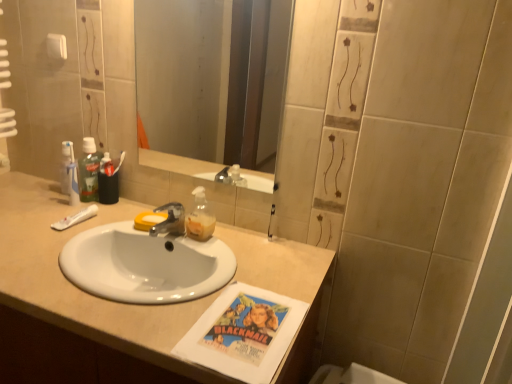
What do you see at coordinates (200, 217) in the screenshot? The width and height of the screenshot is (512, 384). I see `translucent plastic soap dispenser at center` at bounding box center [200, 217].

Locate an element on the screen. The height and width of the screenshot is (384, 512). white glossy sink at center is located at coordinates (79, 300).

Describe the element at coordinates (212, 77) in the screenshot. I see `smooth glass mirror at center` at that location.

This screenshot has width=512, height=384. Describe the element at coordinates (89, 171) in the screenshot. I see `green translucent mouthwash at upper left` at that location.

In order to click on metallic silver faucet at center in this screenshot , I will do coord(170,220).

What are the coordinates of `translucent plastic soap dispenser at center` in the screenshot? It's located at (200, 217).

Based on their positions, is translucent plastic soap dispenser at center located to the left or right of white matte toothpaste at left?

Based on their positions, translucent plastic soap dispenser at center is located to the right of white matte toothpaste at left.

Which object is more forward, translucent plastic soap dispenser at center or white matte toothpaste at left?

translucent plastic soap dispenser at center is more forward.

From a real-world perspective, is translucent plastic soap dispenser at center physically below white matte toothpaste at left?

No, from a real-world perspective, translucent plastic soap dispenser at center is not beneath white matte toothpaste at left.

From the image's perspective, is translucent plastic soap dispenser at center above white matte toothpaste at left?

Yes, from the image's perspective, translucent plastic soap dispenser at center is on top of white matte toothpaste at left.

Looking at this image, which of these two, white glossy sink at center or white matte toothpaste at left, is wider?

With larger width is white glossy sink at center.

Is white glossy sink at center with white matte toothpaste at left?

There is a gap between white glossy sink at center and white matte toothpaste at left.

From a real-world perspective, relative to white matte toothpaste at left, is white glossy sink at center vertically above or below?

Clearly, from a real-world perspective, white glossy sink at center is below white matte toothpaste at left.

Is smooth glass mirror at center positioned before white glossy sink at center?

No, smooth glass mirror at center is further to the viewer.

Considering the points (181, 77) and (168, 349), which point is behind, point (181, 77) or point (168, 349)?

The point (181, 77) is behind.

What are the coordinates of `bathroom cabinet on the left of the smooth glass mirror at center` in the screenshot? It's located at (79, 300).

Is translucent plastic soap dispenser at center far from metallic silver faucet at center?

No, translucent plastic soap dispenser at center is not far from metallic silver faucet at center.

Between translucent plastic soap dispenser at center and metallic silver faucet at center, which one has more height?

translucent plastic soap dispenser at center is taller.

From a real-world perspective, which object rests below the other?

metallic silver faucet at center, from a real-world perspective.

Can you tell me how much translucent plastic soap dispenser at center and metallic silver faucet at center differ in facing direction?

The facing directions of translucent plastic soap dispenser at center and metallic silver faucet at center are 0.000114 degrees apart.

Based on their positions, is white glossy sink at center located to the left or right of translucent plastic soap dispenser at center?

In the image, white glossy sink at center appears on the left side of translucent plastic soap dispenser at center.

From the picture: Does white glossy sink at center have a greater width compared to translucent plastic soap dispenser at center?

Yes, white glossy sink at center is wider than translucent plastic soap dispenser at center.

From the picture: Which is less distant, (190, 372) or (203, 196)?

Point (190, 372)

Is there a large distance between metallic silver faucet at center and white matte toothpaste at left?

No, metallic silver faucet at center is not far from white matte toothpaste at left.

Which is correct: metallic silver faucet at center is inside white matte toothpaste at left, or outside of it?

metallic silver faucet at center is located beyond the bounds of white matte toothpaste at left.

Is metallic silver faucet at center aimed at white matte toothpaste at left?

No, metallic silver faucet at center is not aimed at white matte toothpaste at left.

How many degrees apart are the facing directions of metallic silver faucet at center and white matte toothpaste at left?

There is a 0.000377-degree angle between the facing directions of metallic silver faucet at center and white matte toothpaste at left.

How many degrees apart are the facing directions of white matte toothpaste at left and smooth glass mirror at center?

0.0537 degrees separate the facing orientations of white matte toothpaste at left and smooth glass mirror at center.

Is white matte toothpaste at left taller or shorter than smooth glass mirror at center?

In the image, white matte toothpaste at left appears to be shorter than smooth glass mirror at center.

Where is `toothpaste that is on the left side of smooth glass mirror at center`? toothpaste that is on the left side of smooth glass mirror at center is located at coordinates (76, 218).

Is white matte toothpaste at left positioned with its back to smooth glass mirror at center?

No, smooth glass mirror at center is not at the back of white matte toothpaste at left.

Locate an element on the screen. toothpaste below the translucent plastic soap dispenser at center (from a real-world perspective) is located at coordinates (76, 218).

Image resolution: width=512 pixels, height=384 pixels. Find the location of `toothpaste that is on the left side of white glossy sink at center`. toothpaste that is on the left side of white glossy sink at center is located at coordinates (76, 218).

Based on their spatial positions, is green translucent mouthwash at upper left or smooth glass mirror at center closer to white glossy sink at center?

Among the two, green translucent mouthwash at upper left is located nearer to white glossy sink at center.

Considering their positions, is white matte toothpaste at left positioned closer to green translucent mouthwash at upper left than metallic silver faucet at center?

white matte toothpaste at left.

Based on their spatial positions, is white glossy sink at center or smooth glass mirror at center further from white matte toothpaste at left?

smooth glass mirror at center.

Based on their spatial positions, is metallic silver faucet at center or smooth glass mirror at center closer to white matte toothpaste at left?

metallic silver faucet at center lies closer to white matte toothpaste at left than the other object.

From the image, which object appears to be nearer to translucent plastic soap dispenser at center, metallic silver faucet at center or smooth glass mirror at center?

metallic silver faucet at center is closer to translucent plastic soap dispenser at center.

Which object lies nearer to the anchor point green translucent mouthwash at upper left, smooth glass mirror at center or white matte toothpaste at left?

white matte toothpaste at left.

Based on their spatial positions, is white glossy sink at center or translucent plastic soap dispenser at center further from smooth glass mirror at center?

translucent plastic soap dispenser at center lies further to smooth glass mirror at center than the other object.

From the image, which object appears to be farther from white matte toothpaste at left, white glossy sink at center or green translucent mouthwash at upper left?

Among the two, white glossy sink at center is located further to white matte toothpaste at left.

Identify the location of tap between green translucent mouthwash at upper left and smooth glass mirror at center from left to right. (170, 220).

Identify the location of tap positioned between white glossy sink at center and white matte toothpaste at left from near to far. This screenshot has width=512, height=384. [x=170, y=220].

You are a GUI agent. You are given a task and a screenshot of the screen. Output one action in this format:
    pyautogui.click(x=<x>, y=<y>)
    Task: Click on the toothpaste between smooth glass mirror at center and metallic silver faucet at center in the vertical direction
    The width and height of the screenshot is (512, 384).
    Given the screenshot: What is the action you would take?
    pyautogui.click(x=76, y=218)

The height and width of the screenshot is (384, 512). Identify the location of cleaning product between smooth glass mirror at center and white glossy sink at center from top to bottom. (200, 217).